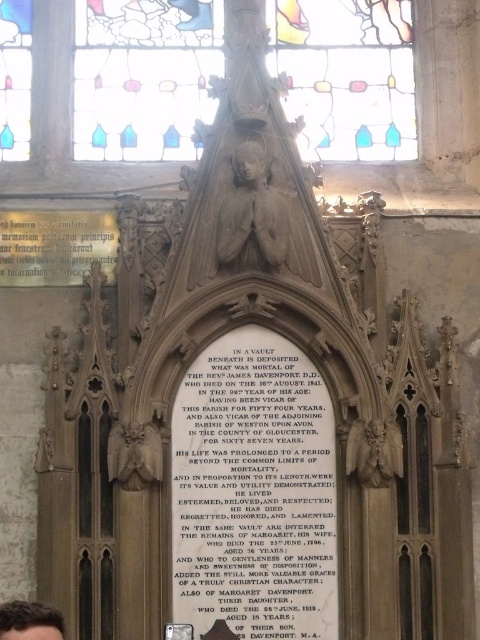
Looking at this image, can you confirm if matte stone inscription at center is thinner than brown hair at lower left?

No.

What are the coordinates of `matte stone inscription at center` in the screenshot? It's located at (253, 492).

The image size is (480, 640). I want to click on matte stone inscription at center, so click(253, 492).

Can you confirm if stained glass window at upper center is taller than matte stone inscription at center?

Incorrect, stained glass window at upper center's height is not larger of matte stone inscription at center's.

Can you confirm if stained glass window at upper center is bigger than matte stone inscription at center?

Indeed, stained glass window at upper center has a larger size compared to matte stone inscription at center.

This screenshot has height=640, width=480. Describe the element at coordinates (143, 76) in the screenshot. I see `stained glass window at upper center` at that location.

I want to click on stained glass window at upper center, so tap(143, 76).

The width and height of the screenshot is (480, 640). Find the location of `stained glass window at upper center`. stained glass window at upper center is located at coordinates (143, 76).

Can you confirm if stained glass window at upper center is positioned below brown hair at lower left?

No.

Is point (139, 74) positioned in front of point (37, 636)?

No, it is behind (37, 636).

The image size is (480, 640). I want to click on stained glass window at upper center, so click(143, 76).